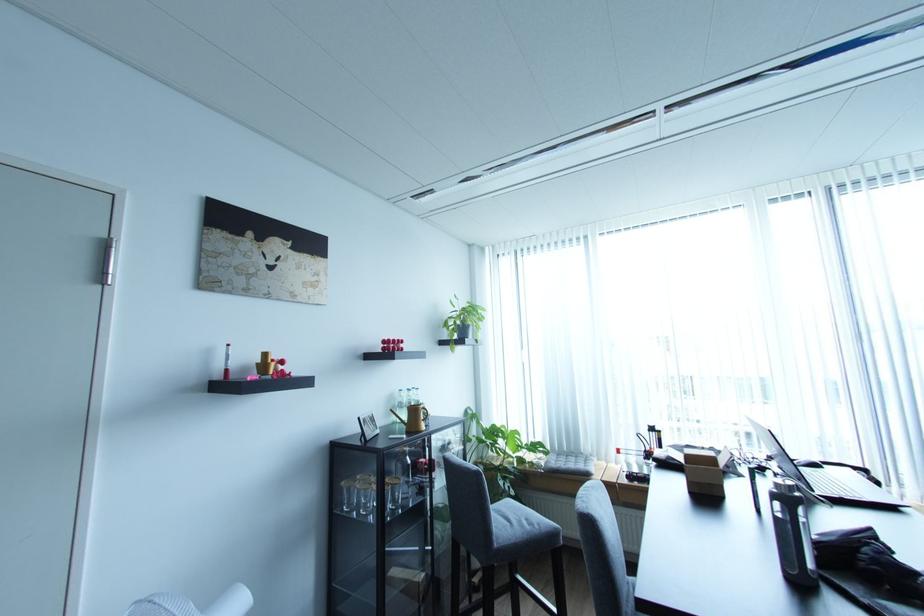
What do you see at coordinates (412, 418) in the screenshot? This screenshot has height=616, width=924. I see `the yellow pitcher handle` at bounding box center [412, 418].